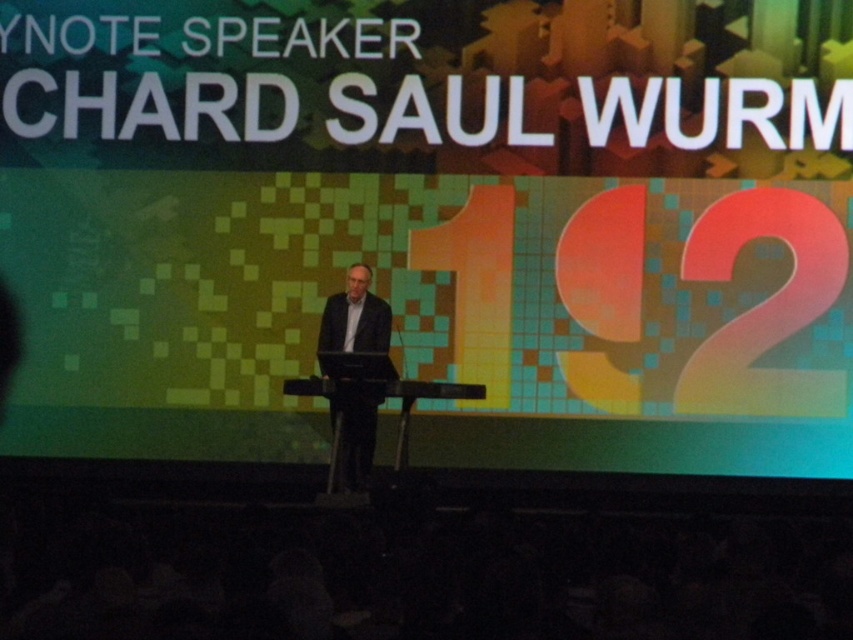
You are an event organizer who needs to adjust the stage lighting to ensure the dark suit at center and the black plastic podium at center are both clearly visible. Considering their height difference, which object might require more focused lighting to avoid blending into the background?

The dark suit at center has a greater height compared to the black plastic podium at center, so the dark suit at center might require more focused lighting to avoid blending into the background due to its taller stature.

You are an event organizer who needs to adjust the microphone stand between the dark suit at center and the black plastic podium at center. The microphone stand requires a minimum of 1.5 meters of space to be placed. Based on the scene, can the microphone stand be placed in between them?

The distance between the dark suit at center and the black plastic podium at center is 2.04 meters, which is more than the required 1.5 meters. Therefore, the microphone stand can be placed between them.

You are an event organizer and need to position a new microphone stand between the dark suit at center and the black plastic podium at center. Based on their positions, which object should the microphone stand be placed closer to?

The dark suit at center is to the left of the black plastic podium at center, so the microphone stand should be placed closer to the black plastic podium at center to maintain alignment with the stage setup.